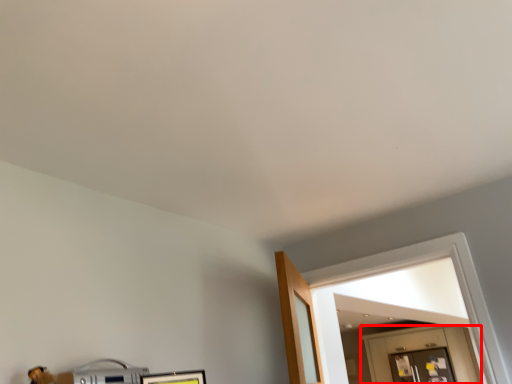
Question: From the image's perspective, where is door (annotated by the red box) located relative to glass door?

Choices:
 (A) above
 (B) below

Answer: (A)